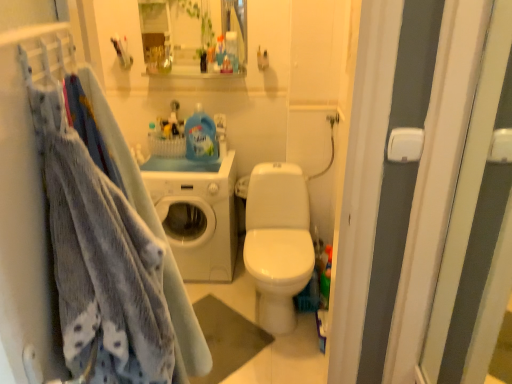
Question: Is matte white cabinet at upper center bigger than soft blue fabric at left?

Choices:
 (A) yes
 (B) no

Answer: (B)

Question: From the image's perspective, is matte white cabinet at upper center beneath soft blue fabric at left?

Choices:
 (A) no
 (B) yes

Answer: (A)

Question: From a real-world perspective, does matte white cabinet at upper center stand above soft blue fabric at left?

Choices:
 (A) yes
 (B) no

Answer: (A)

Question: Does matte white cabinet at upper center have a greater width compared to soft blue fabric at left?

Choices:
 (A) yes
 (B) no

Answer: (A)

Question: From a real-world perspective, is matte white cabinet at upper center under soft blue fabric at left?

Choices:
 (A) no
 (B) yes

Answer: (A)

Question: Does matte white cabinet at upper center have a greater height compared to soft blue fabric at left?

Choices:
 (A) no
 (B) yes

Answer: (A)

Question: Is soft blue fabric at left positioned in front of matte white cabinet at upper center?

Choices:
 (A) yes
 (B) no

Answer: (A)

Question: Does soft blue fabric at left come behind matte white cabinet at upper center?

Choices:
 (A) no
 (B) yes

Answer: (A)

Question: Is soft blue fabric at left to the right of matte white cabinet at upper center from the viewer's perspective?

Choices:
 (A) no
 (B) yes

Answer: (B)

Question: Considering the relative sizes of soft blue fabric at left and matte white cabinet at upper center in the image provided, is soft blue fabric at left bigger than matte white cabinet at upper center?

Choices:
 (A) yes
 (B) no

Answer: (A)

Question: Is soft blue fabric at left facing towards matte white cabinet at upper center?

Choices:
 (A) no
 (B) yes

Answer: (A)

Question: Could matte white cabinet at upper center be considered to be inside soft blue fabric at left?

Choices:
 (A) yes
 (B) no

Answer: (B)

Question: Considering the relative sizes of matte white cabinet at upper center and white glossy washing machine at center in the image provided, is matte white cabinet at upper center shorter than white glossy washing machine at center?

Choices:
 (A) yes
 (B) no

Answer: (A)